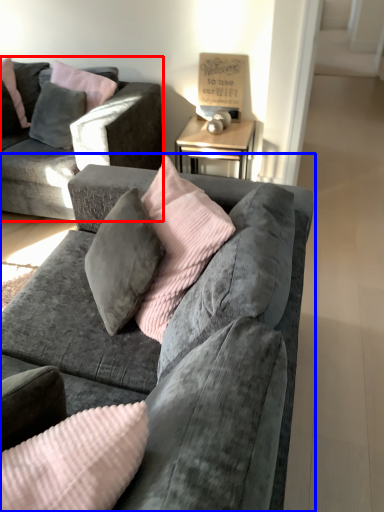
Question: Which of the following is the closest to the observer, studio couch (highlighted by a red box) or studio couch (highlighted by a blue box)?

Choices:
 (A) studio couch
 (B) studio couch

Answer: (B)